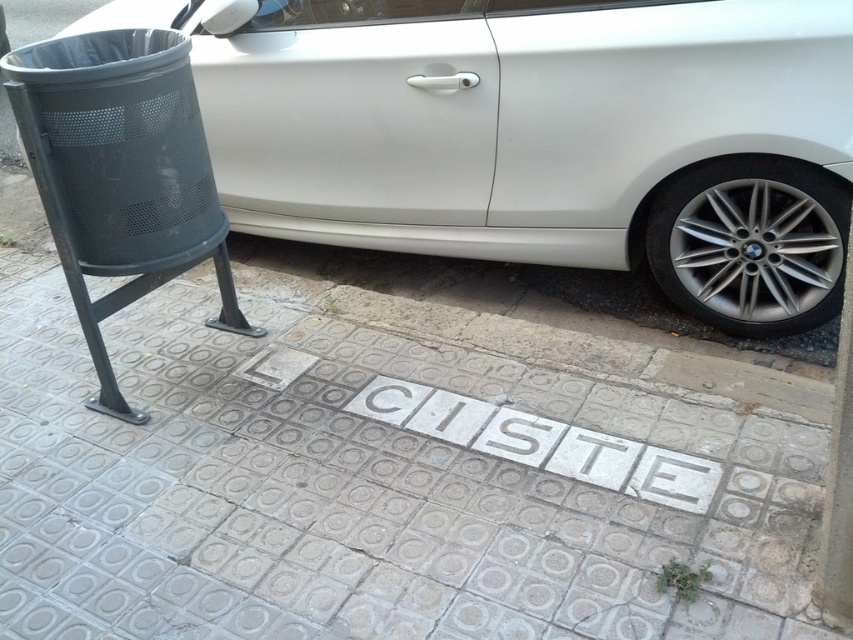
What do you see at coordinates (386, 477) in the screenshot? This screenshot has width=853, height=640. I see `white tile pavement at lower center` at bounding box center [386, 477].

Can you confirm if white tile pavement at lower center is bigger than sleek white car at center?

Indeed, white tile pavement at lower center has a larger size compared to sleek white car at center.

Is point (50, 426) positioned after point (326, 132)?

No, it is not.

The image size is (853, 640). Find the location of `white tile pavement at lower center`. white tile pavement at lower center is located at coordinates (386, 477).

Identify the location of white tile pavement at lower center. Image resolution: width=853 pixels, height=640 pixels. (386, 477).

Is point (189, 342) positioned behind point (744, 193)?

Yes.

Does point (177, 323) lie behind point (817, 260)?

Yes, point (177, 323) is behind point (817, 260).

This screenshot has height=640, width=853. What are the coordinates of `white tile pavement at lower center` in the screenshot? It's located at point(386,477).

Based on the photo, who is higher up, sleek white car at center or silver metallic wheel at lower right?

sleek white car at center

Which is behind, point (631, 54) or point (723, 282)?

Point (723, 282)

Does point (178, 22) come in front of point (666, 227)?

No.

Image resolution: width=853 pixels, height=640 pixels. Find the location of `sleek white car at center`. sleek white car at center is located at coordinates (543, 134).